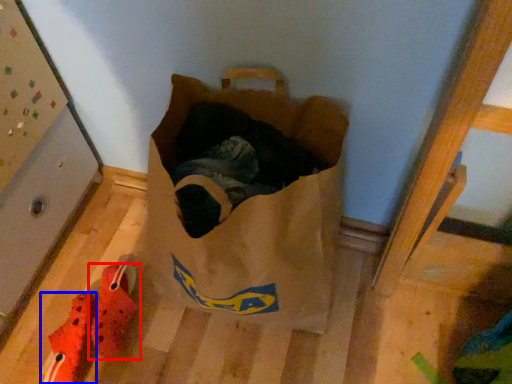
Question: Which point is further to the camera, footwear (highlighted by a red box) or footwear (highlighted by a blue box)?

Choices:
 (A) footwear
 (B) footwear

Answer: (A)